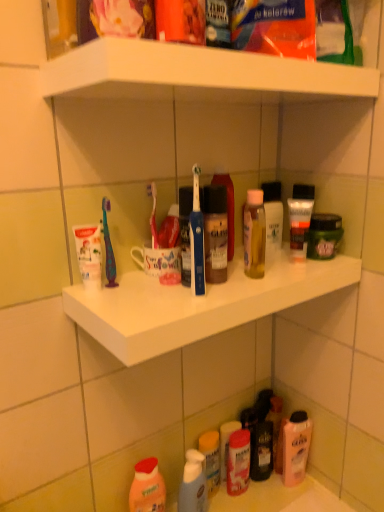
You are a GUI agent. You are given a task and a screenshot of the screen. Output one action in this format:
    pyautogui.click(x=<x>, y=<y>)
    Task: Click on the vacant space situated on the left part of blue plastic toothbrush at center
    
    Given the screenshot: What is the action you would take?
    pyautogui.click(x=135, y=301)